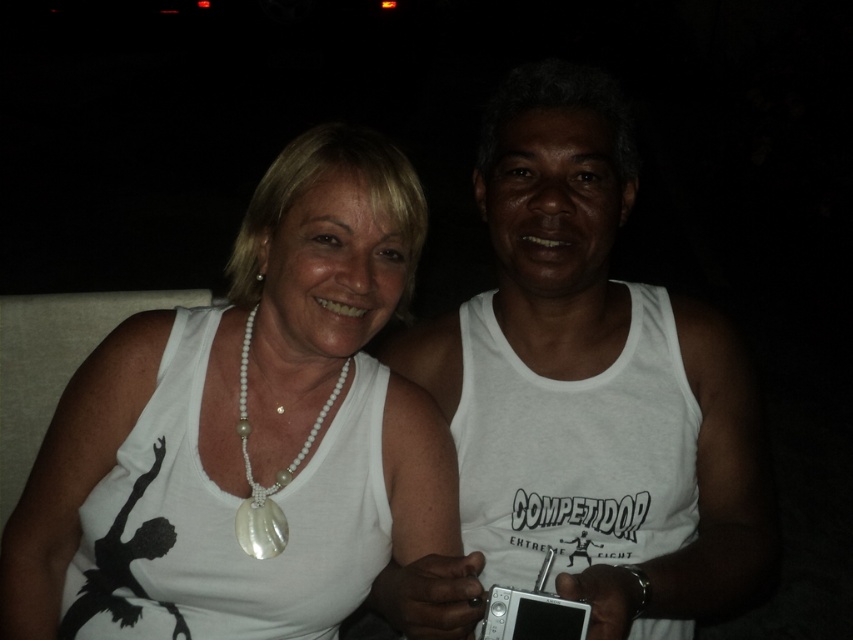
Question: Is white pearl necklace at upper left behind pearl/shell necklace at center?

Choices:
 (A) no
 (B) yes

Answer: (A)

Question: Which point is farther from the camera taking this photo?

Choices:
 (A) (439, 579)
 (B) (328, 397)

Answer: (B)

Question: Does white matte tank top at right come in front of pearl/shell necklace at center?

Choices:
 (A) no
 (B) yes

Answer: (B)

Question: Is white pearl necklace at upper left bigger than pearl/shell necklace at center?

Choices:
 (A) no
 (B) yes

Answer: (B)

Question: Which point appears farthest from the camera in this image?

Choices:
 (A) (59, 612)
 (B) (579, 506)
 (C) (247, 365)

Answer: (B)

Question: Which point appears farthest from the camera in this image?

Choices:
 (A) (280, 540)
 (B) (242, 268)
 (C) (560, 397)

Answer: (C)